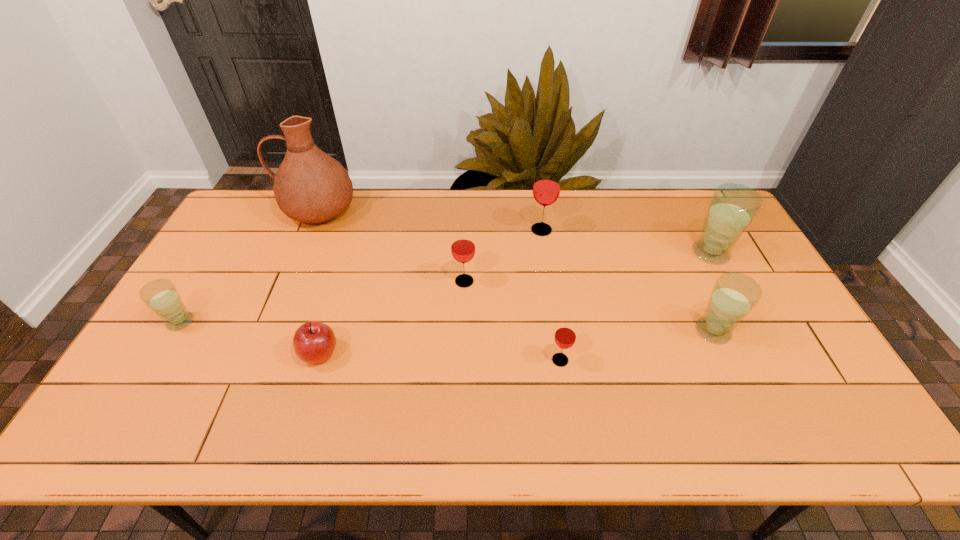
What are the coordinates of `vacant point located on the front of the leftmost blue glass` in the screenshot? It's located at (124, 416).

The width and height of the screenshot is (960, 540). In order to click on vacant space located on the right of the apple in this screenshot , I will do `click(427, 354)`.

Locate an element on the screen. The width and height of the screenshot is (960, 540). pitcher positioned at the far edge is located at coordinates (310, 186).

Locate an element on the screen. The image size is (960, 540). glass present at the far edge is located at coordinates (546, 189).

You are a GUI agent. You are given a task and a screenshot of the screen. Output one action in this format:
    pyautogui.click(x=<x>, y=<y>)
    Task: Click on the pitcher located at the left edge
    
    Given the screenshot: What is the action you would take?
    pyautogui.click(x=310, y=186)

What are the coordinates of `glass present at the left edge` in the screenshot? It's located at (160, 295).

Where is `object at the right edge`? This screenshot has height=540, width=960. object at the right edge is located at coordinates (732, 208).

Where is `object located in the far left corner section of the desktop`? The image size is (960, 540). object located in the far left corner section of the desktop is located at coordinates (310, 186).

Where is `vacant space at the far edge`? Image resolution: width=960 pixels, height=540 pixels. vacant space at the far edge is located at coordinates (348, 216).

Locate an element on the screen. blank space at the near edge of the desktop is located at coordinates (596, 442).